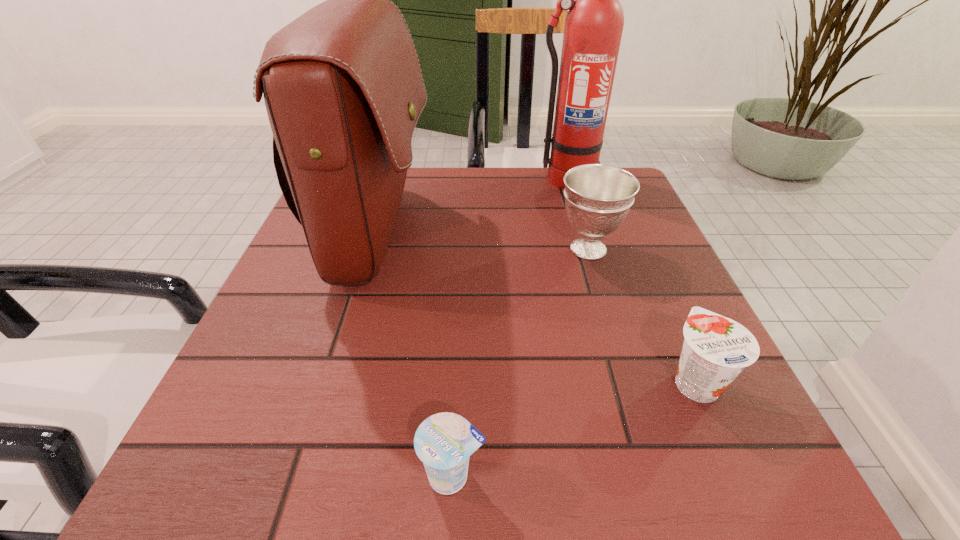
This screenshot has width=960, height=540. In order to click on fire extinguisher in this screenshot , I will do `click(594, 23)`.

The height and width of the screenshot is (540, 960). I want to click on the leftmost object, so click(343, 89).

At what (x,y) coordinates should I click in order to perform the action: click on chalice. Please return your answer as a coordinate pair (x, y). The width and height of the screenshot is (960, 540). Looking at the image, I should click on (598, 197).

Where is `the farther yogurt`? The height and width of the screenshot is (540, 960). the farther yogurt is located at coordinates (716, 349).

In order to click on the fourth farthest object in this screenshot , I will do coord(716,349).

The width and height of the screenshot is (960, 540). I want to click on the fourth object from right to left, so click(x=444, y=441).

Where is `the shorter yogurt`? the shorter yogurt is located at coordinates (444, 441).

Where is `free space located 0.050m on the label side of the fire extinguisher`? This screenshot has height=540, width=960. free space located 0.050m on the label side of the fire extinguisher is located at coordinates (571, 201).

You are a GUI agent. You are given a task and a screenshot of the screen. Output one action in this format:
    pyautogui.click(x=<x>, y=<y>)
    Task: Click on the vacant area situated 0.190m on the open flap of the satchel
    This screenshot has height=540, width=960.
    Given the screenshot: What is the action you would take?
    pyautogui.click(x=518, y=234)

The width and height of the screenshot is (960, 540). I want to click on free space located 0.100m on the front of the third shortest object, so click(x=606, y=306).